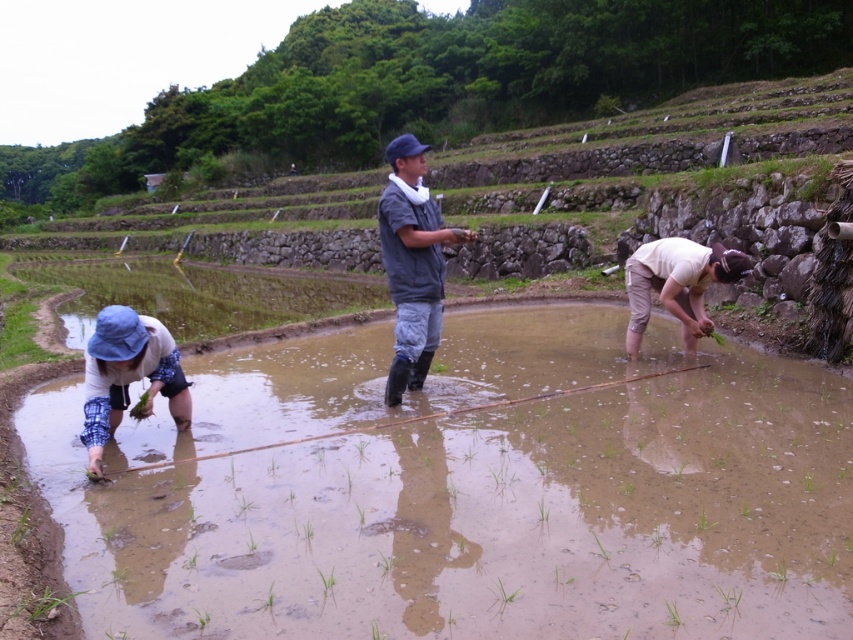
Question: Which object appears farthest from the camera in this image?

Choices:
 (A) gray fabric shirt at center
 (B) light beige fabric at lower right

Answer: (B)

Question: Is gray fabric shirt at center to the left of light beige fabric at lower right from the viewer's perspective?

Choices:
 (A) yes
 (B) no

Answer: (A)

Question: Does gray fabric shirt at center have a greater width compared to light beige fabric at lower right?

Choices:
 (A) no
 (B) yes

Answer: (B)

Question: Is gray fabric shirt at center further to camera compared to blue fabric hat at lower left?

Choices:
 (A) yes
 (B) no

Answer: (A)

Question: Which point is closer to the camera?

Choices:
 (A) (158, 636)
 (B) (399, 268)

Answer: (A)

Question: Which object appears farthest from the camera in this image?

Choices:
 (A) light beige fabric at lower right
 (B) blue fabric hat at lower left

Answer: (A)